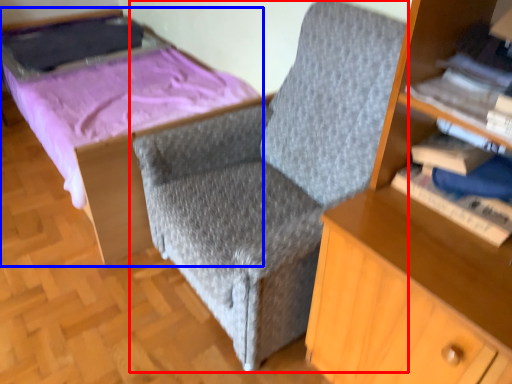
Question: Which point is further to the camera, chair (highlighted by a red box) or bed (highlighted by a blue box)?

Choices:
 (A) chair
 (B) bed

Answer: (B)